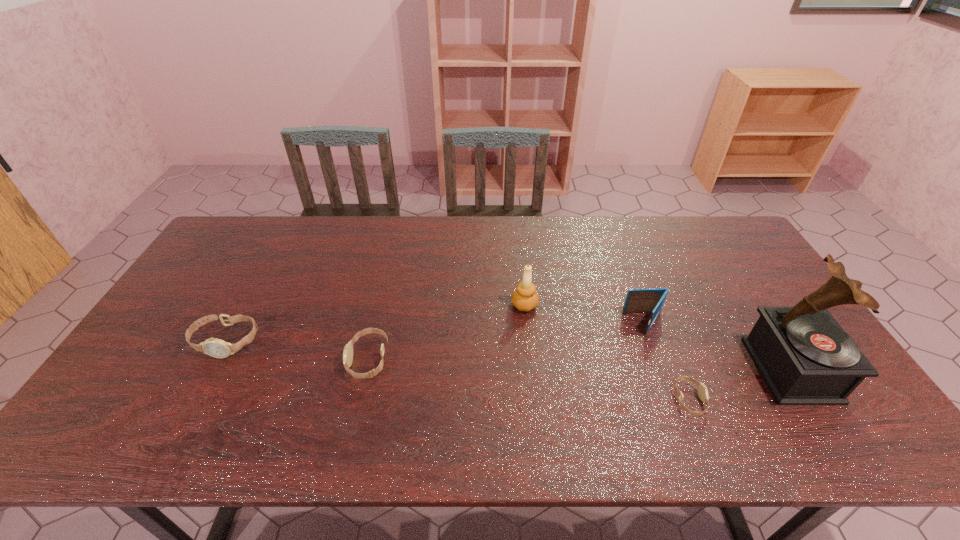
At what (x,y) coordinates should I click in order to perform the action: click on vacant space located 0.240m at the horn opening of the rightmost object. Please return your answer as a coordinate pair (x, y). This screenshot has height=540, width=960. Looking at the image, I should click on tap(664, 370).

Identify the location of blank space located 0.390m at the horn opening of the rightmost object. The height and width of the screenshot is (540, 960). (606, 370).

Identify the location of phonograph_record present at the near edge. (805, 357).

You are a GUI agent. You are given a task and a screenshot of the screen. Output one action in this format:
    pyautogui.click(x=<x>, y=<y>)
    Task: Click on the object that is at the left edge
    The image size is (960, 540).
    Given the screenshot: What is the action you would take?
    pyautogui.click(x=217, y=348)

Find the location of a particular element. The width and height of the screenshot is (960, 540). object at the right edge is located at coordinates (805, 357).

The width and height of the screenshot is (960, 540). Identify the location of object situated at the near right corner. (805, 357).

Locate an element on the screen. This screenshot has height=540, width=960. free space at the far edge is located at coordinates (563, 246).

Where is `free space at the near edge of the desktop`? This screenshot has width=960, height=540. free space at the near edge of the desktop is located at coordinates (381, 382).

The width and height of the screenshot is (960, 540). I want to click on vacant space at the left edge of the desktop, so click(210, 271).

The height and width of the screenshot is (540, 960). In the image, there is a desktop. Find the location of `vacant space at the far left corner`. vacant space at the far left corner is located at coordinates (233, 241).